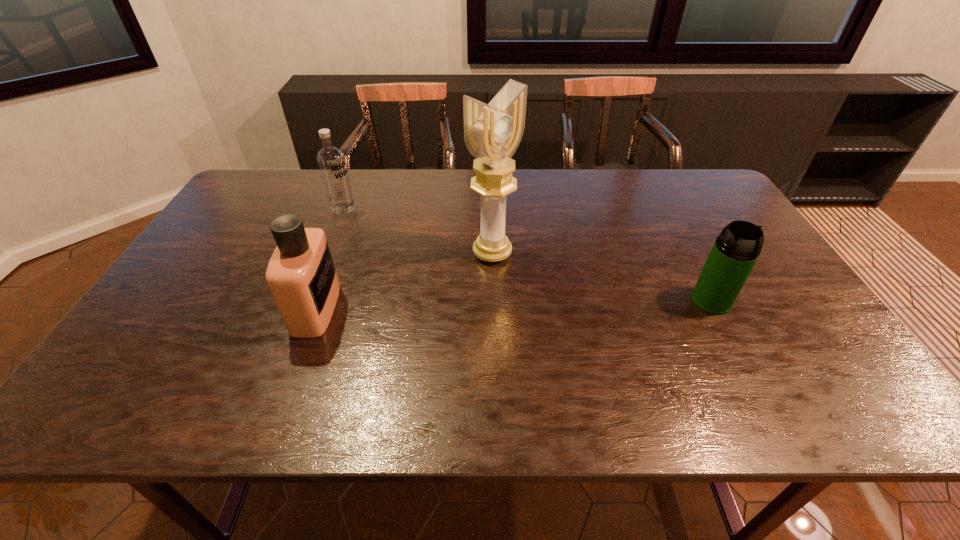
Locate an element on the screen. This screenshot has height=540, width=960. empty location between the rightmost object and the farthest object is located at coordinates (527, 254).

Identify the location of unoccupied position between the rightmost object and the perfume. (514, 305).

Locate an element on the screen. The height and width of the screenshot is (540, 960). unoccupied area between the farthest object and the rightmost object is located at coordinates point(527,254).

Find the location of `blank region between the second farthest object and the farthest object`. blank region between the second farthest object and the farthest object is located at coordinates (418, 231).

The width and height of the screenshot is (960, 540). Identify the location of free spot between the thermos bottle and the perfume. (514, 305).

Where is `vacant space in between the rightmost object and the farthest object`? vacant space in between the rightmost object and the farthest object is located at coordinates (527, 254).

At what (x,y) coordinates should I click in order to perform the action: click on vacant area that lies between the thermos bottle and the tallest object. Please return your answer as a coordinate pair (x, y). This screenshot has height=540, width=960. Looking at the image, I should click on (602, 277).

Where is `vacant space that is in between the award and the rightmost object`? This screenshot has width=960, height=540. vacant space that is in between the award and the rightmost object is located at coordinates (602, 277).

Identify which object is the closest to the perfume. Please provide its 2D coordinates. Your answer should be formatted as a tuple, i.e. [(x, y)], where the tuple contains the x and y coordinates of a point satisfying the conditions above.

[(331, 161)]

Locate an element on the screen. This screenshot has height=540, width=960. object that can be found as the third closest to the perfume is located at coordinates (736, 250).